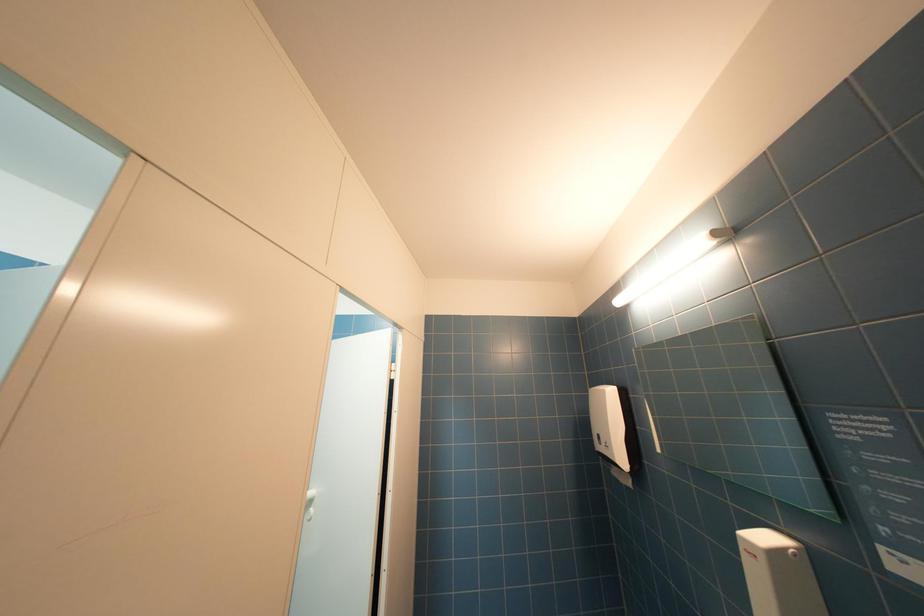
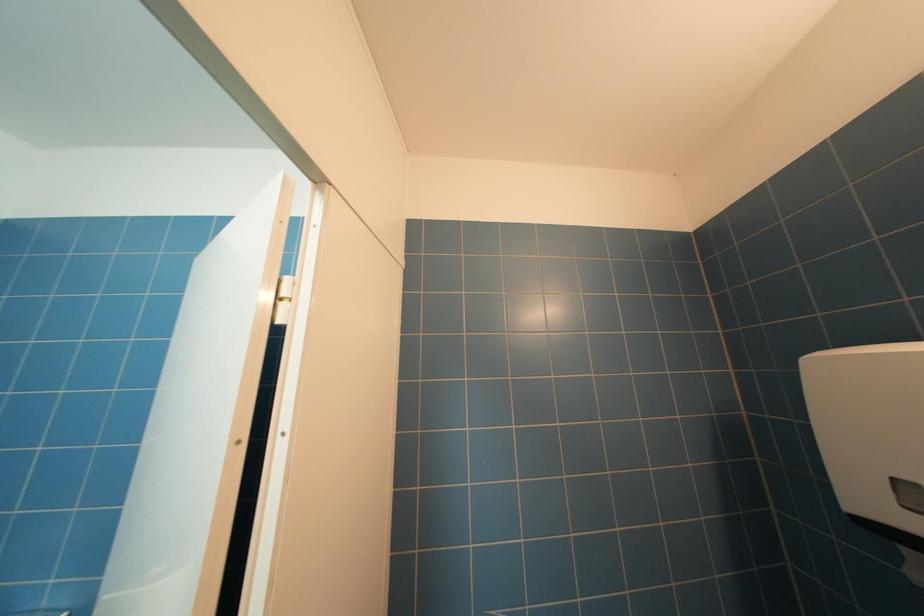
Question: In a continuous first-person perspective shot, in which direction is the camera moving?

Choices:
 (A) Left
 (B) Right
 (C) Forward
 (D) Backward

Answer: (C)